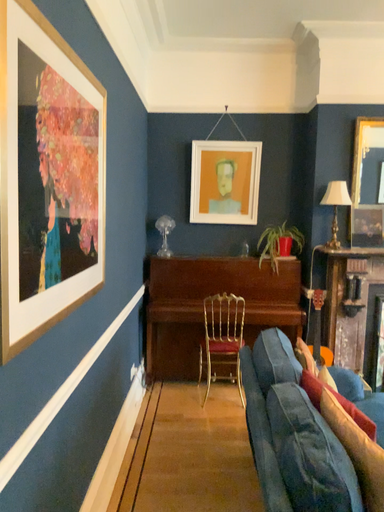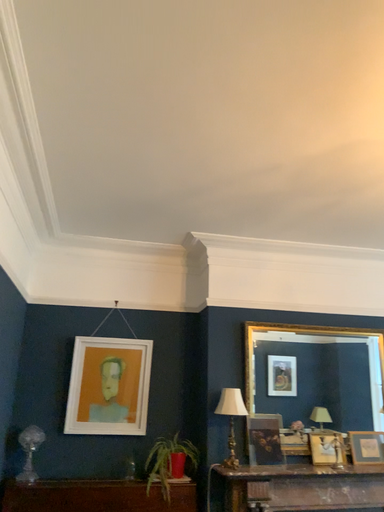
Question: How did the camera likely rotate when shooting the video?

Choices:
 (A) rotated upward
 (B) rotated downward

Answer: (A)